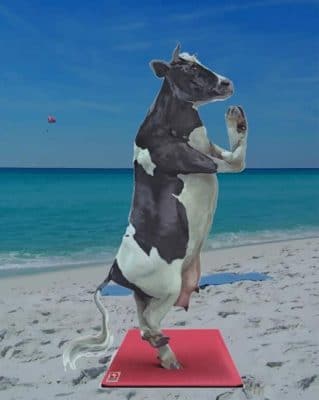
Where is `blue towel`? blue towel is located at coordinates (218, 279).